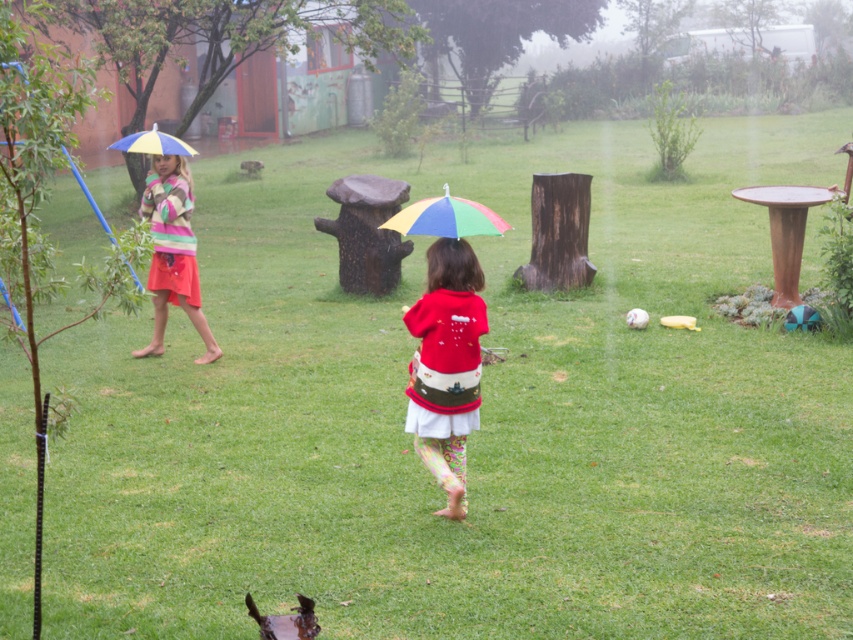
Question: Can you confirm if striped knit sweater at left is positioned to the left of rainbow fabric umbrella at upper left?

Choices:
 (A) yes
 (B) no

Answer: (B)

Question: Estimate the real-world distances between objects in this image. Which object is farther from the matte red sweater at center?

Choices:
 (A) striped knit sweater at left
 (B) rainbow fabric umbrella at upper left
 (C) rainbow fabric umbrella at center

Answer: (A)

Question: Does matte red sweater at center appear over rainbow fabric umbrella at center?

Choices:
 (A) yes
 (B) no

Answer: (B)

Question: Does matte red sweater at center lie in front of rainbow fabric umbrella at center?

Choices:
 (A) yes
 (B) no

Answer: (B)

Question: Which point appears closest to the camera in this image?

Choices:
 (A) (160, 211)
 (B) (424, 205)
 (C) (146, 134)
 (D) (433, 380)

Answer: (D)

Question: Which point is farther from the camera taking this photo?

Choices:
 (A) (392, 225)
 (B) (440, 291)
 (C) (169, 134)
 (D) (172, 301)

Answer: (C)